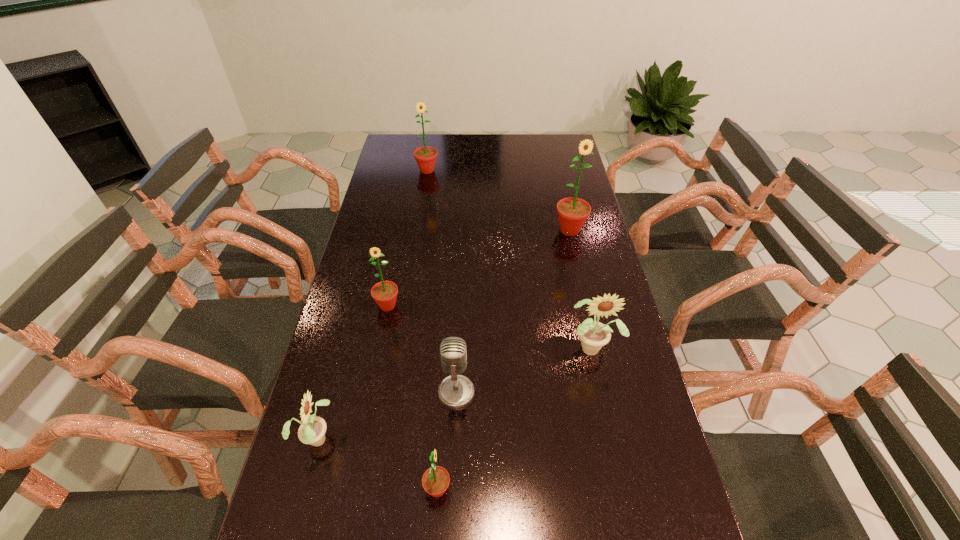
This screenshot has height=540, width=960. In order to click on the third nearest green sunflower in this screenshot , I will do `click(572, 212)`.

Where is `the tallest object`? the tallest object is located at coordinates (572, 212).

What are the coordinates of `the second tallest object` in the screenshot? It's located at (425, 156).

Locate an element on the screen. the farthest sunflower is located at coordinates click(x=425, y=156).

I want to click on the third farthest sunflower, so click(x=384, y=293).

This screenshot has height=540, width=960. I want to click on the third farthest green sunflower, so click(x=384, y=293).

At what (x,y) coordinates should I click in order to perform the action: click on the bigger yellow sunflower. Please return your answer as a coordinate pair (x, y). The height and width of the screenshot is (540, 960). Looking at the image, I should click on point(593,335).

Identify the location of the right yellow sunflower. Image resolution: width=960 pixels, height=540 pixels. (593, 335).

The width and height of the screenshot is (960, 540). Identify the location of the third nearest object. (455, 391).

I want to click on gray microphone, so click(455, 391).